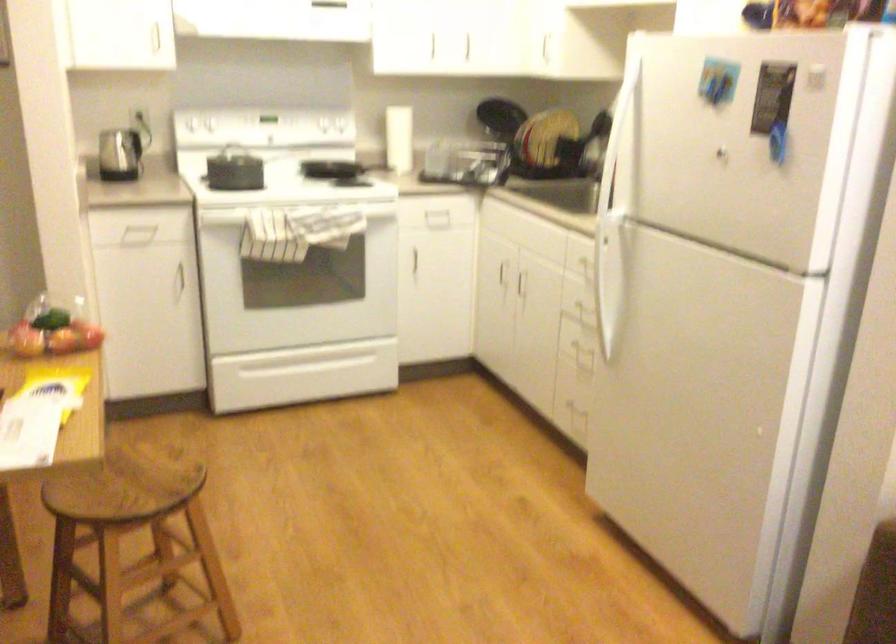
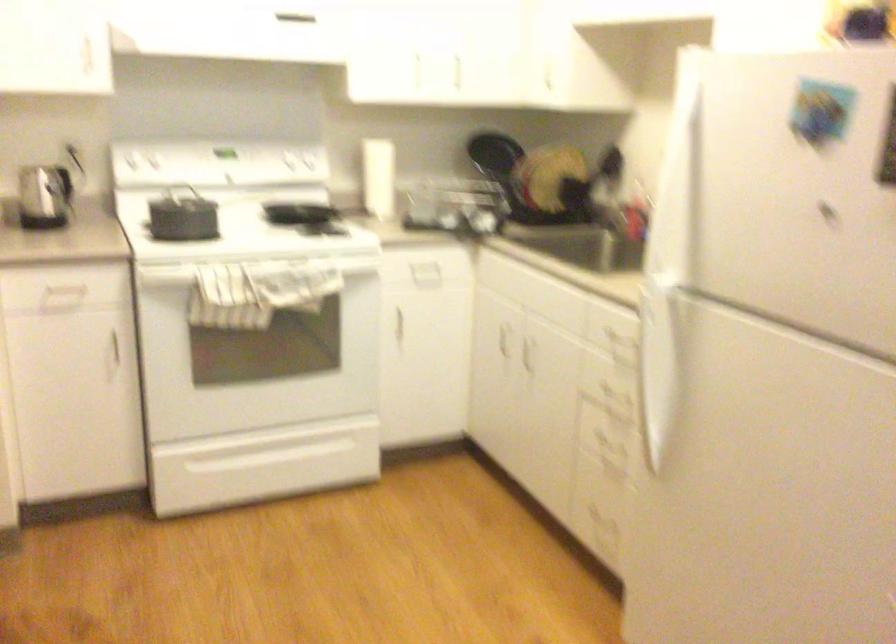
Question: Based on the continuous images, in which direction is the camera rotating? Reply with the corresponding letter.

Choices:
 (A) Left
 (B) Right
 (C) Up
 (D) Down

Answer: (C)